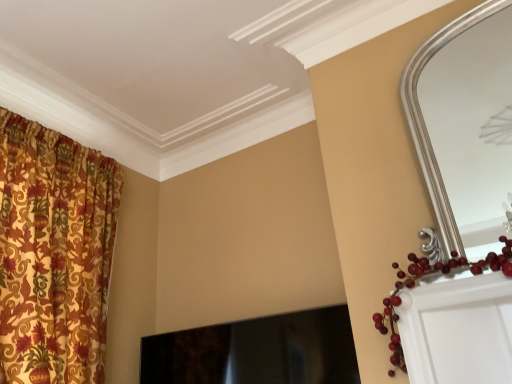
The width and height of the screenshot is (512, 384). What do you see at coordinates (257, 351) in the screenshot?
I see `black glossy fireplace at center` at bounding box center [257, 351].

Measure the distance between black glossy fireplace at center and camera.

They are 1.61 meters apart.

Measure the distance between point [348,314] and camera.

The depth of point [348,314] is 1.46 meters.

Where is `black glossy fireplace at center`? black glossy fireplace at center is located at coordinates (257, 351).

What is the approximate height of silver metallic mirror at upper right?

The height of silver metallic mirror at upper right is 36.33 inches.

At what (x,y) coordinates should I click in order to perform the action: click on silver metallic mirror at upper right. Please return your answer as a coordinate pair (x, y). Image resolution: width=512 pixels, height=384 pixels. Looking at the image, I should click on (464, 122).

What do you see at coordinates (464, 122) in the screenshot?
I see `silver metallic mirror at upper right` at bounding box center [464, 122].

The height and width of the screenshot is (384, 512). Identify the location of black glossy fireplace at center. (257, 351).

Based on their positions, is black glossy fireplace at center located to the left or right of silver metallic mirror at upper right?

Based on their positions, black glossy fireplace at center is located to the left of silver metallic mirror at upper right.

Does black glossy fireplace at center come behind silver metallic mirror at upper right?

Yes, black glossy fireplace at center is further from the camera.

Considering the positions of point (313, 342) and point (487, 229), is point (313, 342) closer or farther from the camera than point (487, 229)?

Clearly, point (313, 342) is closer to the camera than point (487, 229).

From the image's perspective, is black glossy fireplace at center on top of silver metallic mirror at upper right?

No.

From a real-world perspective, which is physically above, black glossy fireplace at center or silver metallic mirror at upper right?

In real-world perspective, silver metallic mirror at upper right is above.

Which of these two, black glossy fireplace at center or silver metallic mirror at upper right, is thinner?

silver metallic mirror at upper right is thinner.

Does black glossy fireplace at center have a lesser height compared to silver metallic mirror at upper right?

Indeed, black glossy fireplace at center has a lesser height compared to silver metallic mirror at upper right.

Which of these two, black glossy fireplace at center or silver metallic mirror at upper right, is bigger?

→ black glossy fireplace at center is bigger.

Is black glossy fireplace at center located outside silver metallic mirror at upper right?

Yes.

Is black glossy fireplace at center touching silver metallic mirror at upper right?

black glossy fireplace at center and silver metallic mirror at upper right are clearly separated.

Could you tell me if black glossy fireplace at center is facing silver metallic mirror at upper right?

No, black glossy fireplace at center is not oriented towards silver metallic mirror at upper right.

In the scene shown: How many degrees apart are the facing directions of black glossy fireplace at center and silver metallic mirror at upper right?

They differ by 3.24 degrees in their facing directions.

This screenshot has height=384, width=512. What are the coordinates of `mirror above the black glossy fireplace at center (from a real-world perspective)` in the screenshot? It's located at (464, 122).

Looking at this image, which is more to the right, silver metallic mirror at upper right or black glossy fireplace at center?

Positioned to the right is silver metallic mirror at upper right.

Considering their positions, is silver metallic mirror at upper right located in front of or behind black glossy fireplace at center?

Visually, silver metallic mirror at upper right is located in front of black glossy fireplace at center.

Considering the positions of point (440, 107) and point (343, 364), is point (440, 107) closer or farther from the camera than point (343, 364)?

Point (440, 107) is positioned farther from the camera compared to point (343, 364).

From the image's perspective, is silver metallic mirror at upper right positioned above or below black glossy fireplace at center?

silver metallic mirror at upper right is above black glossy fireplace at center.

From a real-world perspective, which is physically below, silver metallic mirror at upper right or black glossy fireplace at center?

black glossy fireplace at center.

Which of these two, silver metallic mirror at upper right or black glossy fireplace at center, is thinner?

silver metallic mirror at upper right is thinner.

Is silver metallic mirror at upper right taller or shorter than black glossy fireplace at center?

Considering their sizes, silver metallic mirror at upper right has more height than black glossy fireplace at center.

Looking at the image, does silver metallic mirror at upper right seem bigger or smaller compared to black glossy fireplace at center?

silver metallic mirror at upper right is smaller than black glossy fireplace at center.

Does silver metallic mirror at upper right contain black glossy fireplace at center?

No, black glossy fireplace at center is located outside of silver metallic mirror at upper right.

Is there a large distance between silver metallic mirror at upper right and black glossy fireplace at center?

Yes, silver metallic mirror at upper right is far from black glossy fireplace at center.

Is silver metallic mirror at upper right oriented towards black glossy fireplace at center?

No, silver metallic mirror at upper right is not turned towards black glossy fireplace at center.

How many degrees apart are the facing directions of silver metallic mirror at upper right and black glossy fireplace at center?

There is a 3.24-degree angle between the facing directions of silver metallic mirror at upper right and black glossy fireplace at center.

Measure the distance from silver metallic mirror at upper right to black glossy fireplace at center.

They are 5.93 feet apart.

Locate an element on the screen. The image size is (512, 384). fireplace below the silver metallic mirror at upper right (from a real-world perspective) is located at coordinates (257, 351).

This screenshot has height=384, width=512. What are the coordinates of `mirror located on the right of black glossy fireplace at center` in the screenshot? It's located at (464, 122).

Identify the location of mirror that is above the black glossy fireplace at center (from the image's perspective). The height and width of the screenshot is (384, 512). (464, 122).